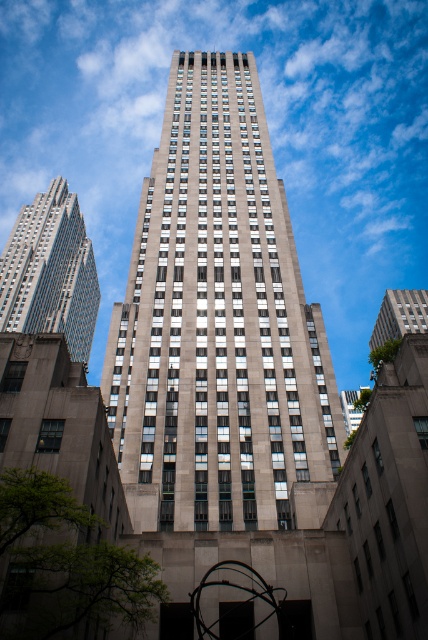
Question: Which of the following is the closest to the observer?

Choices:
 (A) gray stone building at center
 (B) silver glass skyscraper at left

Answer: (A)

Question: Can you confirm if gray stone building at center is positioned to the right of gray stone building at upper right?

Choices:
 (A) yes
 (B) no

Answer: (B)

Question: Is silver glass skyscraper at left in front of gray stone building at upper right?

Choices:
 (A) yes
 (B) no

Answer: (B)

Question: Does gray stone building at center have a smaller size compared to silver glass skyscraper at left?

Choices:
 (A) yes
 (B) no

Answer: (A)

Question: Among these objects, which one is nearest to the camera?

Choices:
 (A) gray stone building at center
 (B) gray stone building at upper right

Answer: (A)

Question: Which point is farther to the camera?

Choices:
 (A) gray stone building at upper right
 (B) silver glass skyscraper at left

Answer: (B)